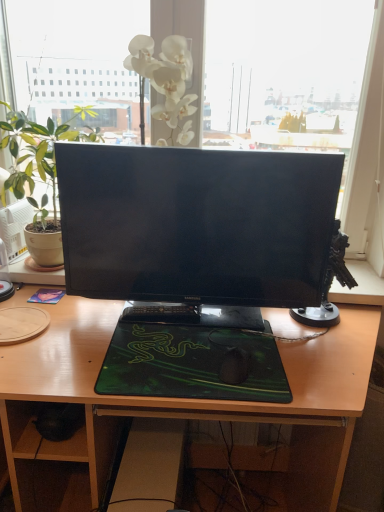
Question: From a real-world perspective, is wooden desk at center positioned over black glossy monitor at center based on gravity?

Choices:
 (A) yes
 (B) no

Answer: (B)

Question: Does wooden desk at center have a larger size compared to black glossy monitor at center?

Choices:
 (A) yes
 (B) no

Answer: (A)

Question: Is the depth of wooden desk at center less than that of black glossy monitor at center?

Choices:
 (A) yes
 (B) no

Answer: (A)

Question: Is wooden desk at center shorter than black glossy monitor at center?

Choices:
 (A) no
 (B) yes

Answer: (A)

Question: Is wooden desk at center facing away from black glossy monitor at center?

Choices:
 (A) yes
 (B) no

Answer: (B)

Question: Could black glossy monitor at center be considered to be inside wooden desk at center?

Choices:
 (A) no
 (B) yes

Answer: (A)

Question: Does green matte mousepad at center come in front of black glossy monitor at center?

Choices:
 (A) no
 (B) yes

Answer: (B)

Question: Considering the relative sizes of green matte mousepad at center and black glossy monitor at center in the image provided, is green matte mousepad at center taller than black glossy monitor at center?

Choices:
 (A) no
 (B) yes

Answer: (A)

Question: Is green matte mousepad at center further to camera compared to black glossy monitor at center?

Choices:
 (A) yes
 (B) no

Answer: (B)

Question: Does green matte mousepad at center have a lesser width compared to black glossy monitor at center?

Choices:
 (A) yes
 (B) no

Answer: (B)

Question: From the image's perspective, is green matte mousepad at center beneath black glossy monitor at center?

Choices:
 (A) no
 (B) yes

Answer: (B)

Question: From a real-world perspective, is green matte mousepad at center on top of black glossy monitor at center?

Choices:
 (A) no
 (B) yes

Answer: (A)

Question: Does green matte mousepad at center touch wooden desk at center?

Choices:
 (A) yes
 (B) no

Answer: (B)